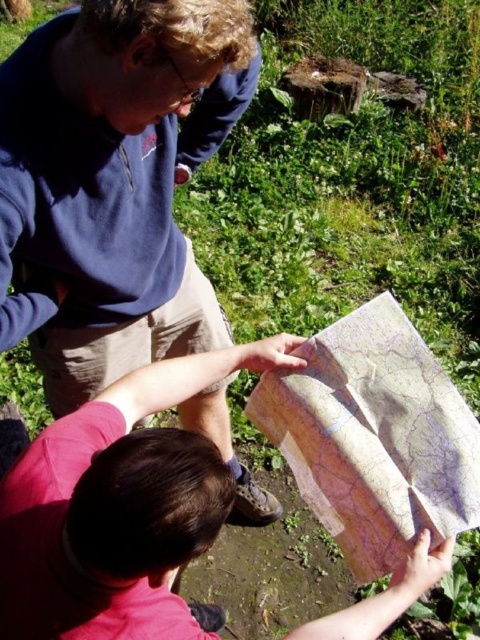
Question: Is blue fleece at upper left bigger than beige paper map at center?

Choices:
 (A) no
 (B) yes

Answer: (B)

Question: Estimate the real-world distances between objects in this image. Which object is closer to the beige paper map at center?

Choices:
 (A) blue fleece at upper left
 (B) smooth paper map at center

Answer: (B)

Question: Which of these objects is positioned closest to the blue fleece at upper left?

Choices:
 (A) smooth paper map at center
 (B) beige paper map at center

Answer: (A)

Question: Can you confirm if blue fleece at upper left is thinner than smooth paper map at center?

Choices:
 (A) yes
 (B) no

Answer: (A)

Question: Considering the relative positions of blue fleece at upper left and smooth paper map at center in the image provided, where is blue fleece at upper left located with respect to smooth paper map at center?

Choices:
 (A) below
 (B) above

Answer: (B)

Question: Among these points, which one is nearest to the camera?

Choices:
 (A) (47, 468)
 (B) (98, 67)
 (C) (414, 385)

Answer: (A)